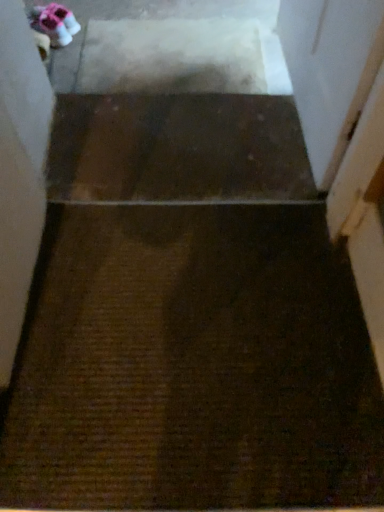
The width and height of the screenshot is (384, 512). Find the location of `transparent plastic screen door at upper right`. transparent plastic screen door at upper right is located at coordinates (x=330, y=71).

I want to click on transparent plastic screen door at upper right, so click(x=330, y=71).

Which object is wider, brown textured carpet at center or matte pink fabric shoe at upper left?

brown textured carpet at center.

Which is behind, point (245, 109) or point (47, 32)?

The point (47, 32) is farther.

Is brown textured carpet at center not within matte pink fabric shoe at upper left?

Yes, brown textured carpet at center is located beyond the bounds of matte pink fabric shoe at upper left.

Is transparent plastic screen door at upper right completely or partially outside of matte pink fabric shoe at upper left?

Indeed, transparent plastic screen door at upper right is completely outside matte pink fabric shoe at upper left.

Can you tell me how much transparent plastic screen door at upper right and matte pink fabric shoe at upper left differ in facing direction?

141 degrees.

From the image's perspective, is transparent plastic screen door at upper right above matte pink fabric shoe at upper left?

No, from the image's perspective, transparent plastic screen door at upper right is not on top of matte pink fabric shoe at upper left.

Looking at this image, measure the distance from transparent plastic screen door at upper right to matte pink fabric shoe at upper left.

The distance of transparent plastic screen door at upper right from matte pink fabric shoe at upper left is 4.25 feet.

Does point (86, 150) come in front of point (366, 40)?

No, it is behind (366, 40).

Can you see brown textured carpet at center touching transparent plastic screen door at upper right?

No.

Can you confirm if brown textured carpet at center is positioned to the right of transparent plastic screen door at upper right?

In fact, brown textured carpet at center is to the left of transparent plastic screen door at upper right.

Does matte pink fabric shoe at upper left have a greater height compared to transparent plastic screen door at upper right?

Incorrect, the height of matte pink fabric shoe at upper left is not larger of that of transparent plastic screen door at upper right.

In terms of size, does matte pink fabric shoe at upper left appear bigger or smaller than transparent plastic screen door at upper right?

In the image, matte pink fabric shoe at upper left appears to be smaller than transparent plastic screen door at upper right.

Considering the positions of points (57, 18) and (373, 8), is point (57, 18) closer to camera compared to point (373, 8)?

No, it is not.

From the image's perspective, would you say matte pink fabric shoe at upper left is shown under transparent plastic screen door at upper right?

Actually, matte pink fabric shoe at upper left appears above transparent plastic screen door at upper right in the image.

Considering the relative sizes of transparent plastic screen door at upper right and brown textured carpet at center in the image provided, is transparent plastic screen door at upper right shorter than brown textured carpet at center?

Incorrect, the height of transparent plastic screen door at upper right does not fall short of that of brown textured carpet at center.

Which object is thinner, transparent plastic screen door at upper right or brown textured carpet at center?

Thinner between the two is transparent plastic screen door at upper right.

Is transparent plastic screen door at upper right in front of or behind brown textured carpet at center in the image?

In the image, transparent plastic screen door at upper right appears in front of brown textured carpet at center.

Is point (365, 21) more distant than point (264, 114)?

No.

Identify the location of stairwell in front of the matte pink fabric shoe at upper left. (178, 149).

How much distance is there between matte pink fabric shoe at upper left and brown textured carpet at center?

They are 91.67 centimeters apart.

Is matte pink fabric shoe at upper left situated inside brown textured carpet at center or outside?

matte pink fabric shoe at upper left is not inside brown textured carpet at center, it's outside.

Locate an element on the screen. The width and height of the screenshot is (384, 512). stairwell that appears above the matte pink fabric shoe at upper left (from a real-world perspective) is located at coordinates (178, 149).

I want to click on shoe lying behind the transparent plastic screen door at upper right, so click(55, 23).

Looking at the image, which one is located closer to brown textured carpet at center, matte pink fabric shoe at upper left or transparent plastic screen door at upper right?

transparent plastic screen door at upper right is closer to brown textured carpet at center.

Based on their spatial positions, is brown textured carpet at center or matte pink fabric shoe at upper left further from transparent plastic screen door at upper right?

The object further to transparent plastic screen door at upper right is matte pink fabric shoe at upper left.

Based on their spatial positions, is transparent plastic screen door at upper right or matte pink fabric shoe at upper left further from brown textured carpet at center?

matte pink fabric shoe at upper left is positioned further to the anchor brown textured carpet at center.

Looking at the image, which one is located closer to transparent plastic screen door at upper right, matte pink fabric shoe at upper left or brown textured carpet at center?

The object closer to transparent plastic screen door at upper right is brown textured carpet at center.

Looking at the image, which one is located closer to matte pink fabric shoe at upper left, brown textured carpet at center or transparent plastic screen door at upper right?

brown textured carpet at center is closer to matte pink fabric shoe at upper left.

Based on their spatial positions, is transparent plastic screen door at upper right or brown textured carpet at center closer to matte pink fabric shoe at upper left?

Among the two, brown textured carpet at center is located nearer to matte pink fabric shoe at upper left.

Locate an element on the screen. The width and height of the screenshot is (384, 512). stairwell between transparent plastic screen door at upper right and matte pink fabric shoe at upper left in the front-back direction is located at coordinates pos(178,149).